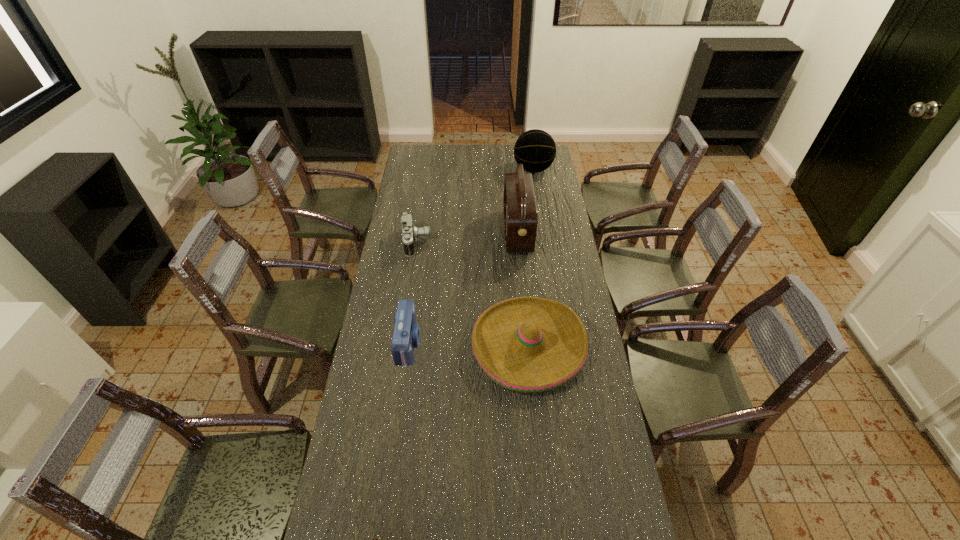
Find the location of a particular element. The width and height of the screenshot is (960, 540). the tallest object is located at coordinates tap(519, 203).

You are a GUI agent. You are given a task and a screenshot of the screen. Output one action in this format:
    pyautogui.click(x=<x>, y=<y>)
    Task: Click on the farthest object
    
    Given the screenshot: What is the action you would take?
    pyautogui.click(x=535, y=149)

Locate an element on the screen. The image size is (960, 540). basketball is located at coordinates (535, 149).

Image resolution: width=960 pixels, height=540 pixels. What are the coordinates of `the second farthest camera` in the screenshot? It's located at (406, 335).

Find the location of a particular element. Image resolution: width=960 pixels, height=540 pixels. sombrero is located at coordinates (526, 344).

Find the location of a particular element. the farthest camera is located at coordinates (409, 232).

You are a GUI agent. You are given a task and a screenshot of the screen. Output one action in this format:
    pyautogui.click(x=<x>, y=<y>)
    Task: Click on the vacant space located 0.270m on the front panel of the tallest object
    
    Given the screenshot: What is the action you would take?
    pyautogui.click(x=445, y=232)

Locate an element on the screen. The image size is (960, 540). blank space located 0.280m on the front panel of the tallest object is located at coordinates (444, 232).

I want to click on free spot located 0.390m on the front panel of the tallest object, so [x=420, y=232].

Where is `vacant area located 0.110m on the left of the fifth shortest object`? The width and height of the screenshot is (960, 540). vacant area located 0.110m on the left of the fifth shortest object is located at coordinates (492, 170).